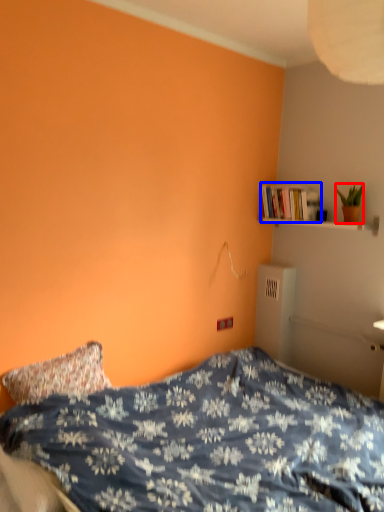
Question: Which object appears closest to the camera in this image, houseplant (highlighted by a red box) or book (highlighted by a blue box)?

Choices:
 (A) houseplant
 (B) book

Answer: (A)